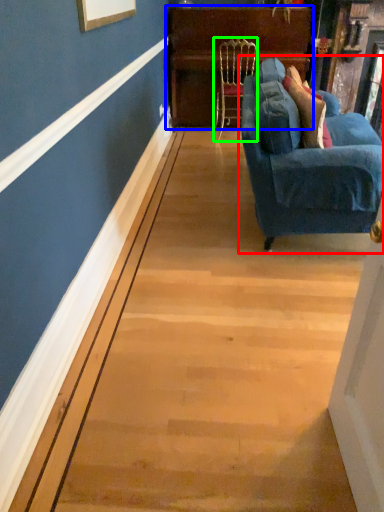
Question: Estimate the real-world distances between objects in this image. Which object is closer to studio couch (highlighted by a red box), dresser (highlighted by a blue box) or chair (highlighted by a green box)?

Choices:
 (A) dresser
 (B) chair

Answer: (B)